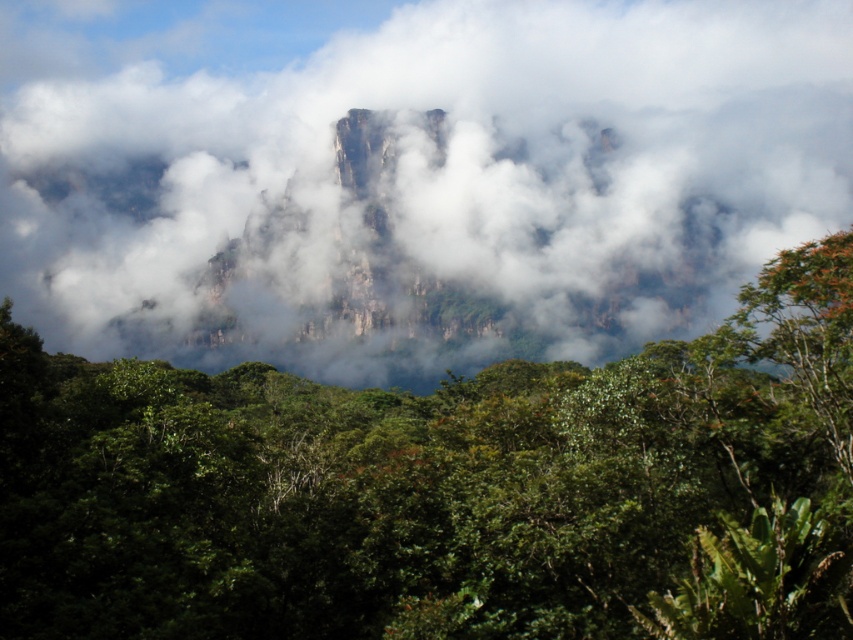
Between white fluffy cloud at center and green leafy tree at upper center, which one is positioned higher?

white fluffy cloud at center is higher up.

Can you confirm if white fluffy cloud at center is bigger than green leafy tree at upper center?

Yes.

The image size is (853, 640). Describe the element at coordinates (431, 186) in the screenshot. I see `white fluffy cloud at center` at that location.

Locate an element on the screen. white fluffy cloud at center is located at coordinates (431, 186).